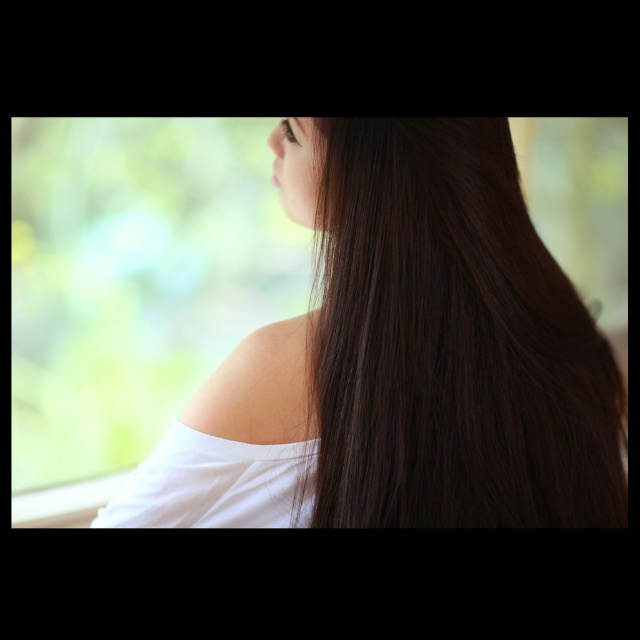
You are standing in front of the person in the image. You want to place a small flower exactly at point (340, 509). If your hand can reach up to 70 centimeters, will you be able to reach that point?

The point (340, 509) is 75.87 centimeters from the viewer, which is beyond your hand reach of 70 centimeters. Therefore, you cannot reach that point.

You are a fashion designer observing the image. You need to decide which fabric to use for a new line inspired by the subject. Since the dark brown silky hair at center and the white smooth shoulder at center are central to the design, which one requires a larger piece of fabric due to its size?

The dark brown silky hair at center requires a larger piece of fabric because it is bigger than the white smooth shoulder at center.

You are taking a photo of the scene and want to ensure the dark brown silky hair at center is in focus. Given that the camera focuses best at coordinates between 0.5 and 0.6 on the vertical axis, will the hair be in focus?

The dark brown silky hair at center is located at point 0.706 on the vertical axis, which is outside the camera focus range of 0.5 to 0.6. Therefore, the hair will not be in focus.